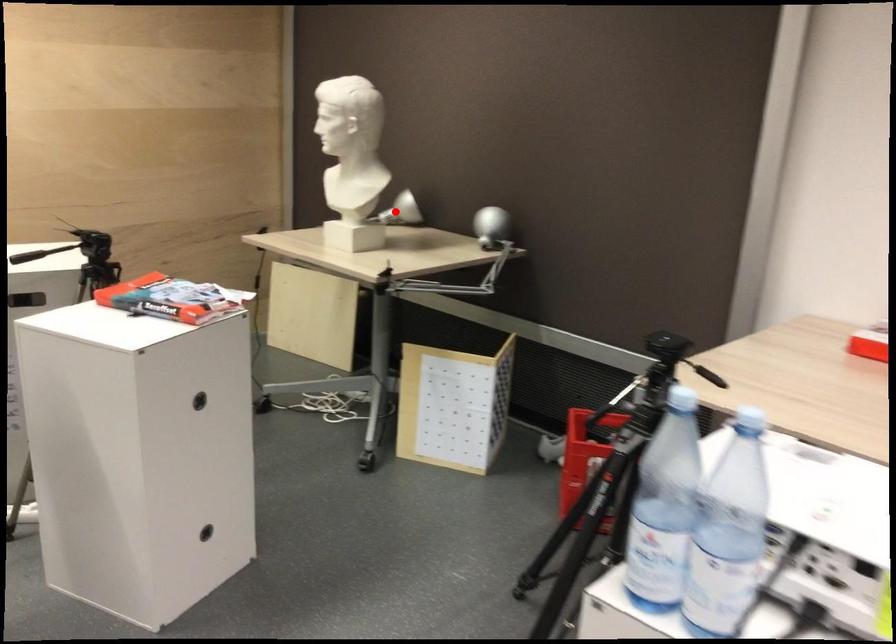
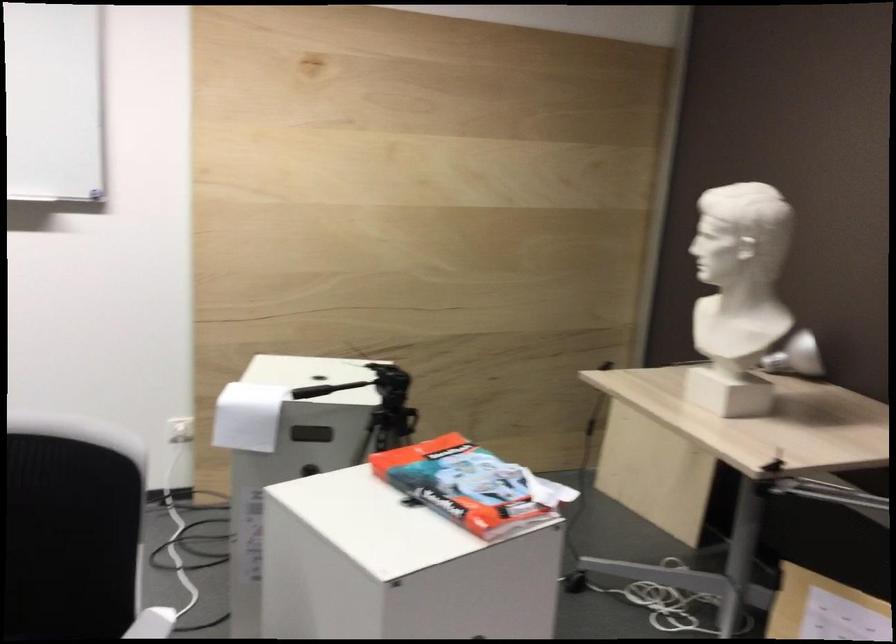
Locate, in the second image, the point that corresponds to the highlighted location in the first image.

(795, 357)